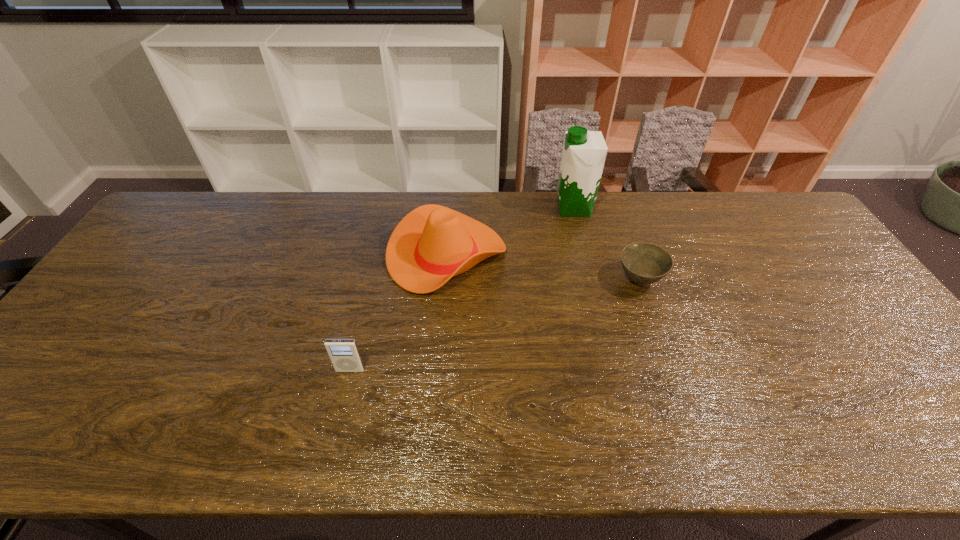
The height and width of the screenshot is (540, 960). I want to click on the tallest object, so click(584, 152).

You are a GUI agent. You are given a task and a screenshot of the screen. Output one action in this format:
    pyautogui.click(x=<x>, y=<y>)
    Task: Click on the third object from left to right
    Image resolution: width=960 pixels, height=540 pixels.
    Given the screenshot: What is the action you would take?
    pyautogui.click(x=584, y=152)

You are a GUI agent. You are given a task and a screenshot of the screen. Output one action in this format:
    pyautogui.click(x=<x>, y=<y>)
    Task: Click on the third shortest object
    
    Given the screenshot: What is the action you would take?
    pyautogui.click(x=431, y=244)

This screenshot has width=960, height=540. What are the coordinates of `iPod` in the screenshot? It's located at pyautogui.click(x=344, y=354).

Locate an element on the screen. The image size is (960, 540). the third tallest object is located at coordinates (344, 354).

This screenshot has height=540, width=960. Identify the location of bowl. (644, 263).

Where is `the rightmost object`? the rightmost object is located at coordinates (644, 263).

In order to click on vacant space positioned 0.360m on the front-facing side of the tallest object in this screenshot , I will do pos(450,208).

I want to click on free space located on the front-facing side of the tallest object, so point(526,208).

I want to click on free space located 0.220m on the front-facing side of the tallest object, so click(x=491, y=208).